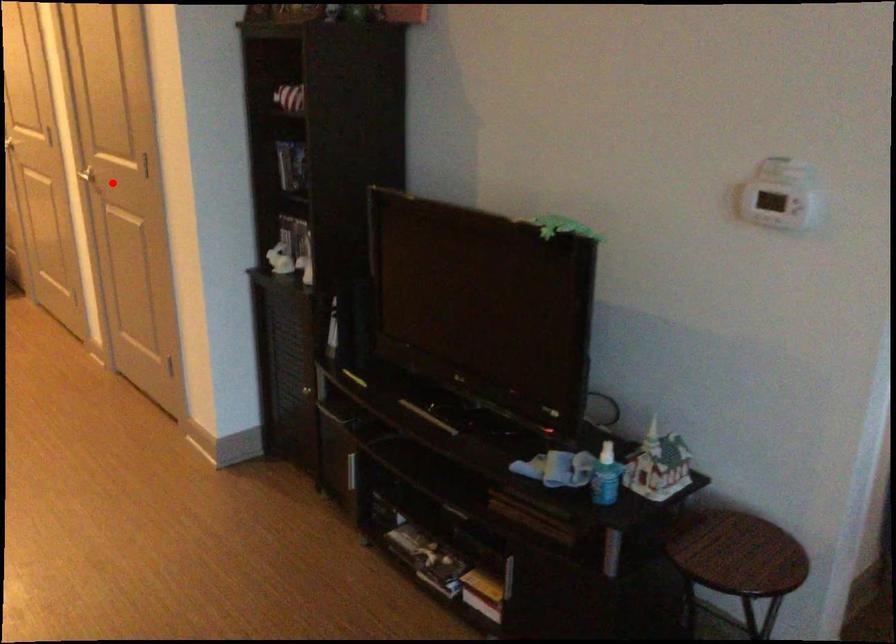
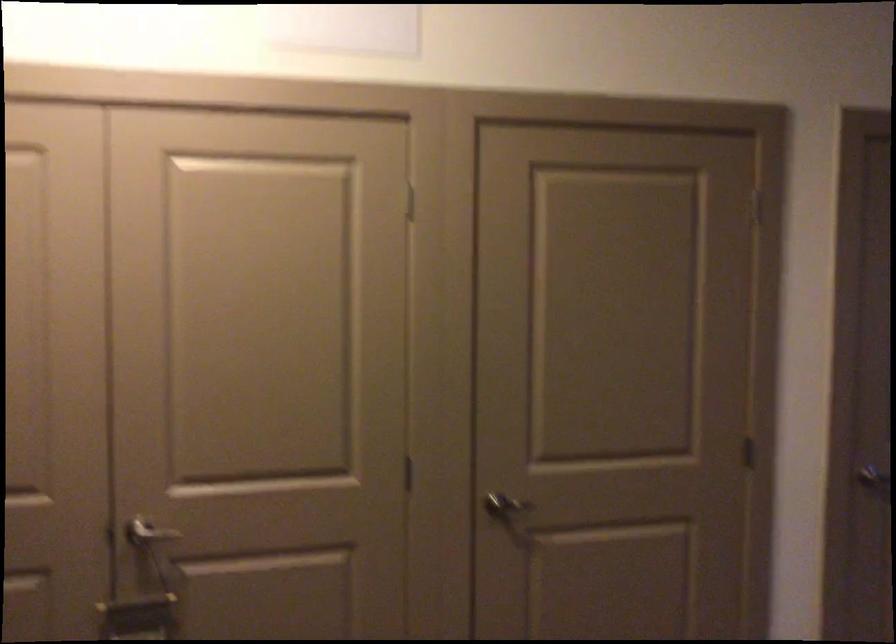
Locate, in the second image, the point that corresponds to the highlighted location in the first image.

(853, 476)